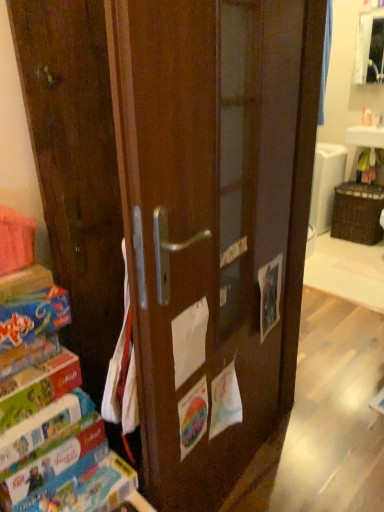
Question: Is matte brown cabinet at upper right further to the viewer compared to matte cardboard book at left, the fourth paperback book in the bottom-to-top sequence?

Choices:
 (A) no
 (B) yes

Answer: (B)

Question: From a real-world perspective, is matte brown cabinet at upper right below matte cardboard book at left, the fourth paperback book in the bottom-to-top sequence?

Choices:
 (A) yes
 (B) no

Answer: (B)

Question: Does matte brown cabinet at upper right have a larger size compared to matte cardboard book at left, the fourth paperback book in the bottom-to-top sequence?

Choices:
 (A) no
 (B) yes

Answer: (B)

Question: Is matte brown cabinet at upper right facing towards matte cardboard book at left, which is counted as the 1th paperback book, starting from the top?

Choices:
 (A) no
 (B) yes

Answer: (B)

Question: Does matte brown cabinet at upper right appear on the left side of matte cardboard book at left, the fourth paperback book in the bottom-to-top sequence?

Choices:
 (A) yes
 (B) no

Answer: (B)

Question: In the image, is hardcover book at left, which ranks as the fourth paperback book in top-to-bottom order, on the left side or the right side of matte brown cabinet at upper right?

Choices:
 (A) right
 (B) left

Answer: (B)

Question: From the image's perspective, is hardcover book at left, which ranks as the fourth paperback book in top-to-bottom order, above or below matte brown cabinet at upper right?

Choices:
 (A) below
 (B) above

Answer: (A)

Question: Is hardcover book at left, which ranks as the fourth paperback book in top-to-bottom order, situated inside matte brown cabinet at upper right or outside?

Choices:
 (A) outside
 (B) inside

Answer: (A)

Question: In the image, is hardcover book at left, which ranks as the fourth paperback book in top-to-bottom order, positioned in front of or behind matte brown cabinet at upper right?

Choices:
 (A) behind
 (B) front

Answer: (B)

Question: Visually, is matte brown cabinet at upper right positioned to the left or to the right of matte cardboard book at lower left, acting as the 2th paperback book starting from the bottom?

Choices:
 (A) left
 (B) right

Answer: (B)

Question: Looking at the image, does matte brown cabinet at upper right seem bigger or smaller compared to matte cardboard book at lower left, acting as the 2th paperback book starting from the bottom?

Choices:
 (A) big
 (B) small

Answer: (A)

Question: In the image, is matte brown cabinet at upper right positioned in front of or behind matte cardboard book at lower left, acting as the 2th paperback book starting from the bottom?

Choices:
 (A) front
 (B) behind

Answer: (B)

Question: From a real-world perspective, is matte brown cabinet at upper right positioned above or below matte cardboard book at lower left, arranged as the third paperback book when viewed from the top?

Choices:
 (A) above
 (B) below

Answer: (A)

Question: In terms of size, does matte cardboard book at left, which is counted as the 1th paperback book, starting from the top, appear bigger or smaller than matte cardboard book at lower left, positioned as the 2th paperback book in top-to-bottom order?

Choices:
 (A) big
 (B) small

Answer: (A)

Question: From their relative heights in the image, would you say matte cardboard book at left, which is counted as the 1th paperback book, starting from the top, is taller or shorter than matte cardboard book at lower left, positioned as the 2th paperback book in top-to-bottom order?

Choices:
 (A) short
 (B) tall

Answer: (B)